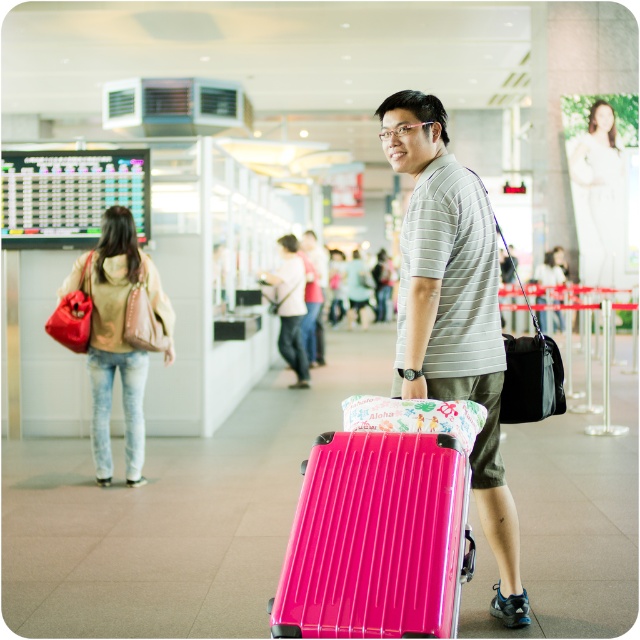
You are an airport security agent checking luggage dimensions. The maximum allowed width for carryons is 50 cm. You observe the glossy plastic suitcase at lower center and the matte gray shirt at center. Which item is narrower and would comply with the width restriction?

The glossy plastic suitcase at lower center has a lesser width compared to matte gray shirt at center, so the glossy plastic suitcase at lower center is narrower and would comply with the width restriction.

You are a traveler who needs to check if your luggage can be placed in the overhead compartment. The airline requires that the sum of the length, width, and height of the luggage must not exceed 62 inches. You have a glossy plastic suitcase at lower center and a matte beige jacket at center. What is the combined total of the dimensions of both items?

The glossy plastic suitcase at lower center and matte beige jacket at center are 9.18 meters apart. However, the distance between them does not provide information about their individual dimensions. Without specific measurements for each item, it is impossible to determine if their combined dimensions meet the airline requirement.

You are a traveler standing at the entrance of the airport terminal. You see the glossy plastic suitcase at lower center. Can you reach it without moving from your current position?

The glossy plastic suitcase at lower center is 2.65 meters away from the viewer, so you cannot reach it without moving closer.